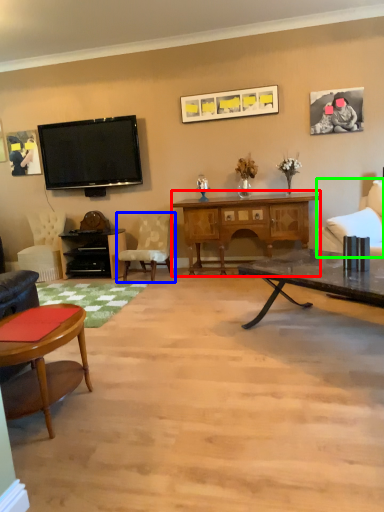
Question: Which object is the closest to the desk (highlighted by a red box)? Choose among these: chair (highlighted by a blue box) or chair (highlighted by a green box).

Choices:
 (A) chair
 (B) chair

Answer: (A)